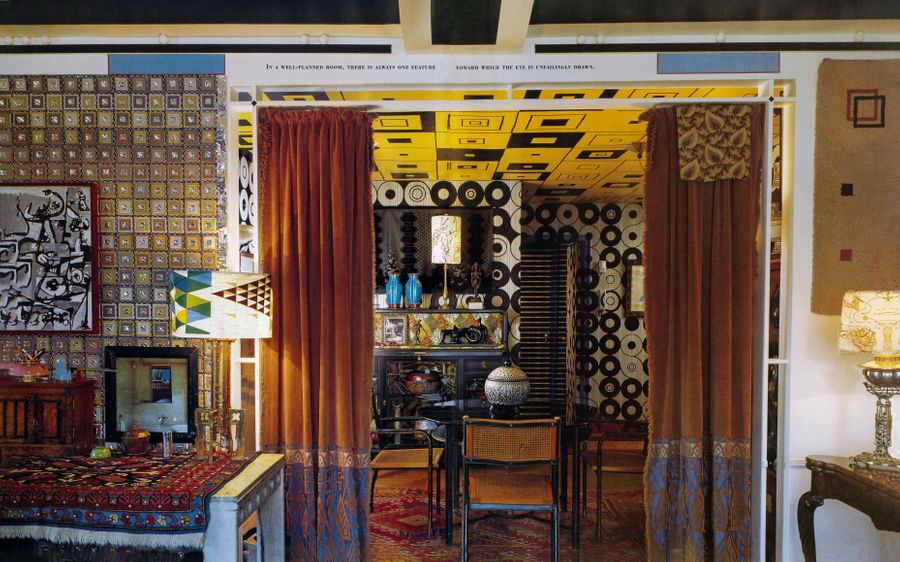
The image size is (900, 562). What are the coordinates of `wood table` in the screenshot? It's located at (866, 494), (267, 489).